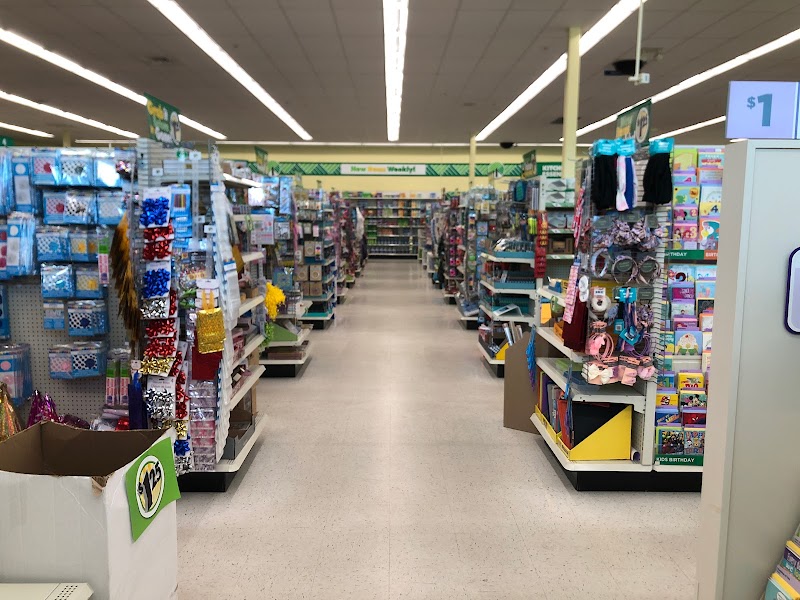
Where is `retail shelving`? retail shelving is located at coordinates (250, 439), (302, 349), (318, 314), (541, 430), (486, 353), (465, 318), (449, 286).